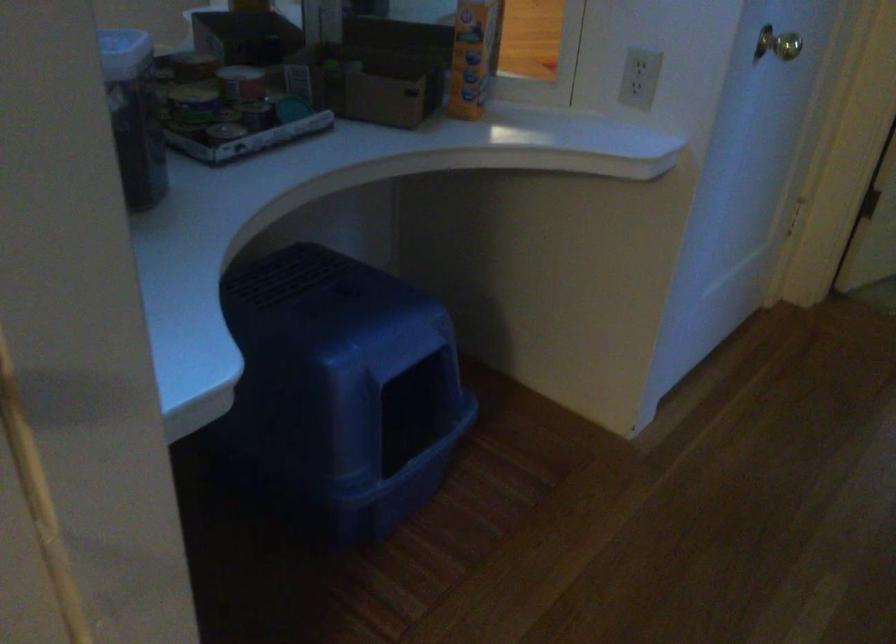
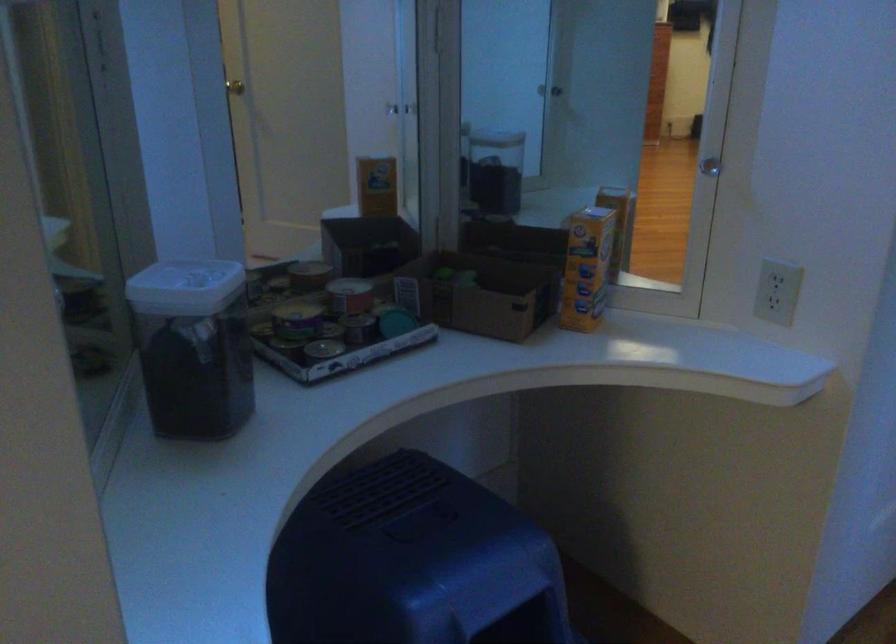
Question: The camera is either moving clockwise (left) or counter-clockwise (right) around the object. The first image is from the beginning of the video and the second image is from the end. Is the camera moving left or right when shooting the video?

Choices:
 (A) Left
 (B) Right

Answer: (B)